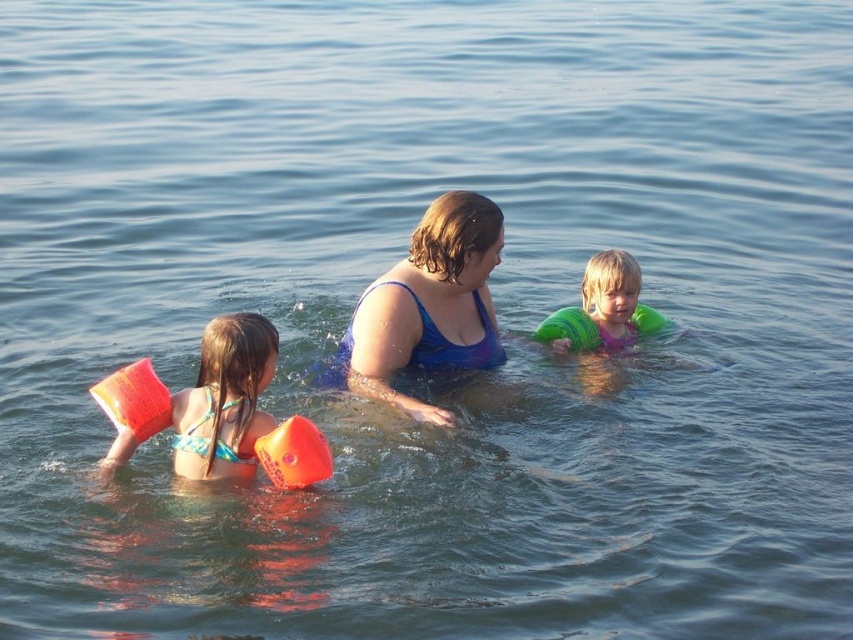
Which of these two, orange rubber arm float at left or orange rubber arm float at lower left, stands taller?

orange rubber arm float at left is taller.

Can you confirm if orange rubber arm float at left is positioned above orange rubber arm float at lower left?

Correct, orange rubber arm float at left is located above orange rubber arm float at lower left.

Does point (149, 360) come farther from viewer compared to point (270, 460)?

Yes, it is behind point (270, 460).

The width and height of the screenshot is (853, 640). In order to click on orange rubber arm float at left in this screenshot , I will do `click(134, 400)`.

Which is below, blue fabric swimsuit at center or green rubber arm bands at center?

green rubber arm bands at center

Between blue fabric swimsuit at center and green rubber arm bands at center, which one appears on the left side from the viewer's perspective?

blue fabric swimsuit at center is more to the left.

Locate an element on the screen. The width and height of the screenshot is (853, 640). blue fabric swimsuit at center is located at coordinates (430, 305).

Can you confirm if blue fabric swimsuit at center is thinner than matte orange floaties at left?

No, blue fabric swimsuit at center is not thinner than matte orange floaties at left.

Is point (476, 365) farther from viewer compared to point (251, 348)?

That is True.

You are a GUI agent. You are given a task and a screenshot of the screen. Output one action in this format:
    pyautogui.click(x=<x>, y=<y>)
    Task: Click on the blue fabric swimsuit at center
    The image size is (853, 640).
    Given the screenshot: What is the action you would take?
    pyautogui.click(x=430, y=305)

In order to click on blue fabric swimsuit at center in this screenshot , I will do `click(430, 305)`.